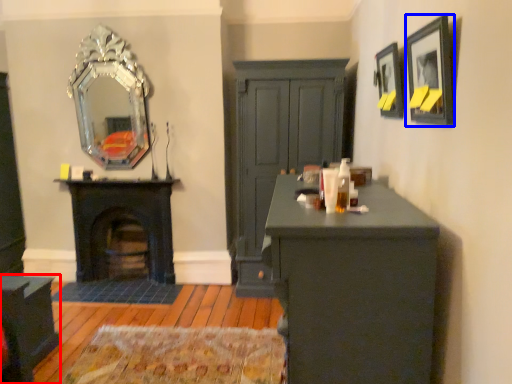
Question: Among these objects, which one is nearest to the camera, cabinetry (highlighted by a red box) or picture frame (highlighted by a blue box)?

Choices:
 (A) cabinetry
 (B) picture frame

Answer: (B)